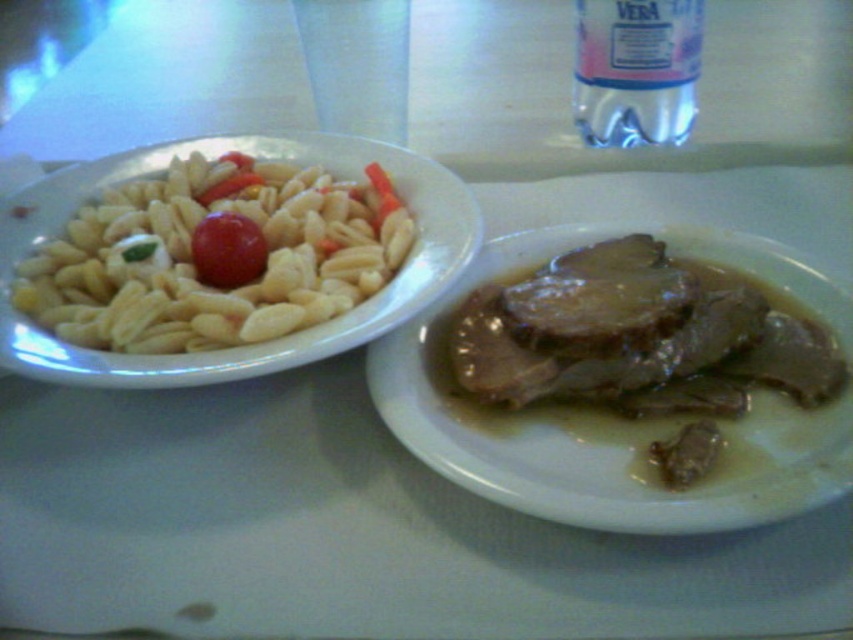
Does transparent plastic bottle at upper center have a lesser height compared to red glossy cherry tomato at upper left?

No, transparent plastic bottle at upper center is not shorter than red glossy cherry tomato at upper left.

Is point (607, 88) positioned before point (372, 179)?

No, it is not.

Locate an element on the screen. transparent plastic bottle at upper center is located at coordinates (636, 70).

Is white matte pasta at left shorter than transparent plastic bottle at upper center?

Incorrect, white matte pasta at left's height does not fall short of transparent plastic bottle at upper center's.

The width and height of the screenshot is (853, 640). I want to click on white matte pasta at left, so click(x=195, y=266).

Does transparent plastic bottle at upper center appear under glossy red tomato at center left?

Incorrect, transparent plastic bottle at upper center is not positioned below glossy red tomato at center left.

Does point (641, 26) come in front of point (225, 252)?

No, (641, 26) is further to viewer.

What do you see at coordinates (636, 70) in the screenshot? I see `transparent plastic bottle at upper center` at bounding box center [636, 70].

Where is `transparent plastic bottle at upper center`? transparent plastic bottle at upper center is located at coordinates (636, 70).